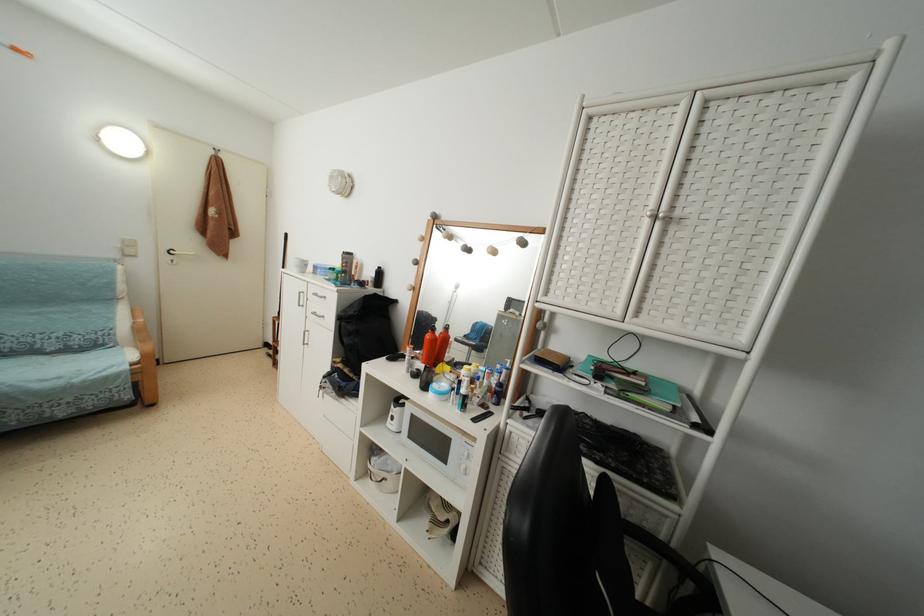
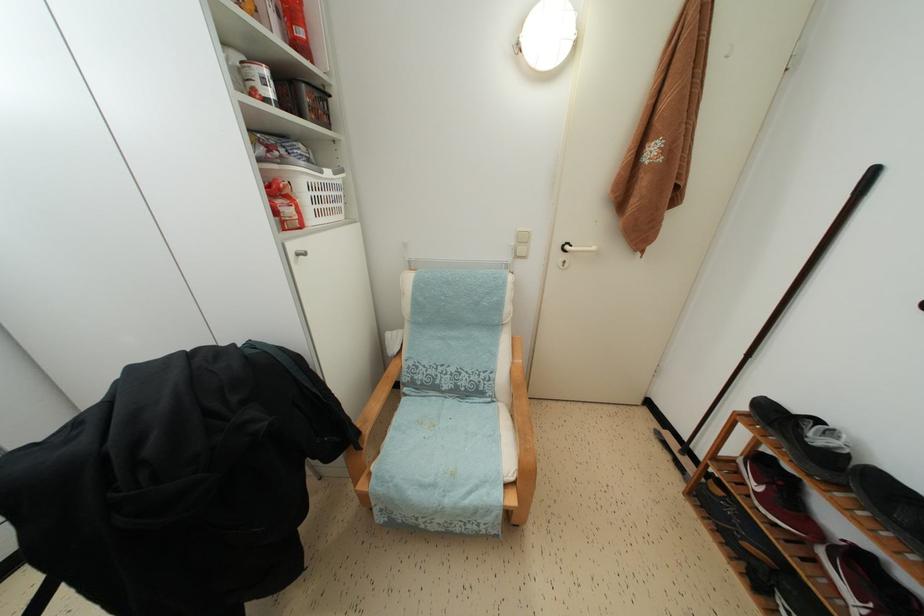
Find the pixel in the second image that matches the point at 134,249 in the first image.

(527, 245)